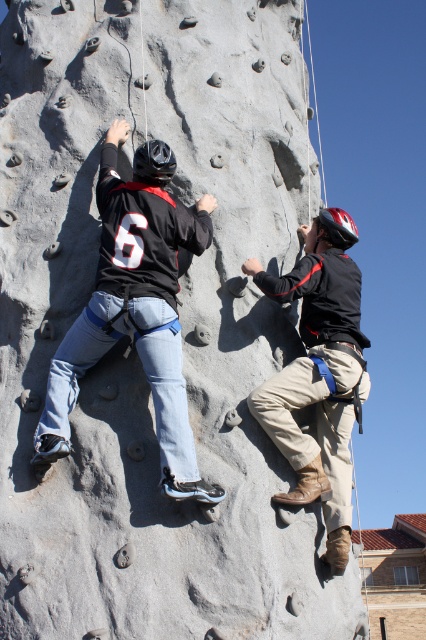
Is matte black helmet at upper left in front of matte black helmet at upper center?

Yes.

Between point (36, 449) and point (284, 369), which one is positioned behind?

Positioned behind is point (284, 369).

You are a GUI agent. You are given a task and a screenshot of the screen. Output one action in this format:
    pyautogui.click(x=<x>, y=<y>)
    Task: Click on the matte black helmet at upper left
    Image resolution: width=426 pixels, height=640 pixels.
    Given the screenshot: What is the action you would take?
    pyautogui.click(x=135, y=307)